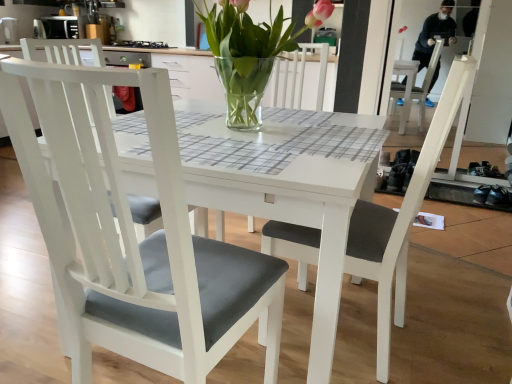
Where is `vacant area on top of white matte chair at left, the second chair when ordered from right to left (from a real-world perspective)`? vacant area on top of white matte chair at left, the second chair when ordered from right to left (from a real-world perspective) is located at coordinates (264, 132).